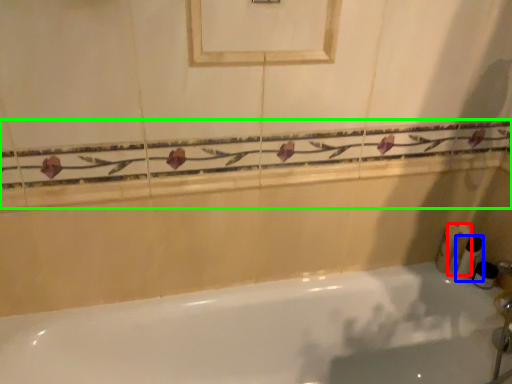
Question: Considering the real-world distances, which object is closest to toiletry (highlighted by a red box)? toiletry (highlighted by a blue box) or balustrade (highlighted by a green box).

Choices:
 (A) toiletry
 (B) balustrade

Answer: (A)